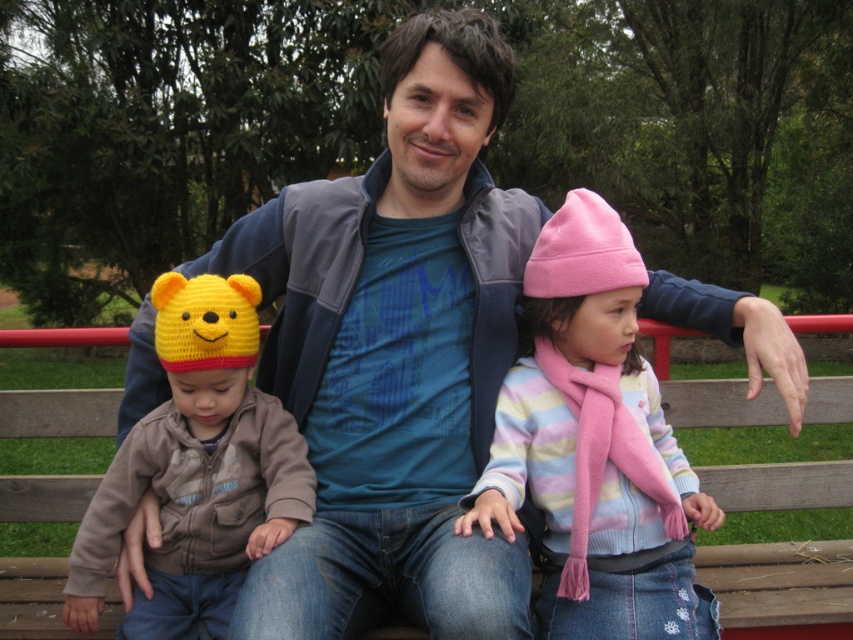
Which is in front, point (547, 488) or point (107, 472)?

Point (547, 488)

Between pink fleece hat at center and knitted yellow hat at left, which one has more height?

pink fleece hat at center is taller.

Is point (566, 614) in front of point (177, 486)?

Yes, it is in front of point (177, 486).

Locate an element on the screen. The image size is (853, 640). pink fleece hat at center is located at coordinates (595, 445).